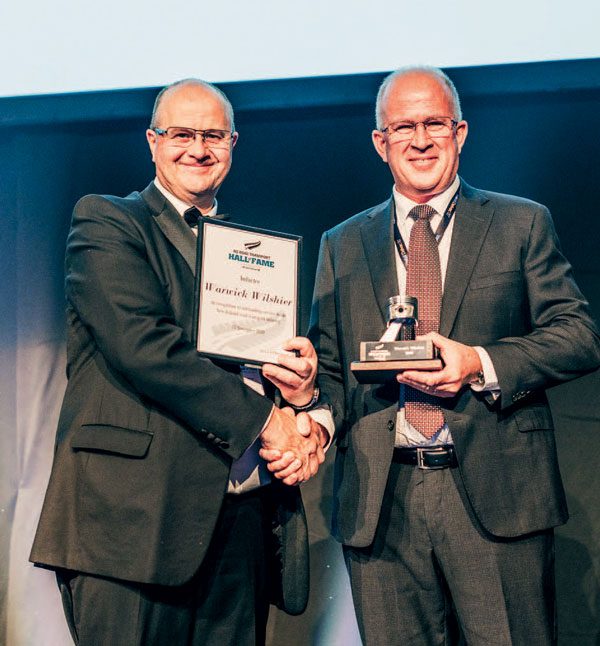
Locate an element on the screen. This screenshot has height=646, width=600. wall is located at coordinates (366, 42).